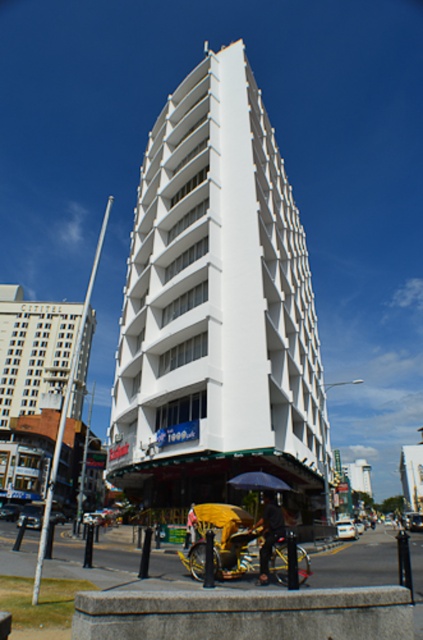
Can you confirm if dark gray fabric umbrella at center is positioned to the left of yellow fabric at center?

Incorrect, dark gray fabric umbrella at center is not on the left side of yellow fabric at center.

Is point (269, 513) less distant than point (186, 515)?

Yes, it is.

Where is `dark gray fabric umbrella at center`? This screenshot has height=640, width=423. dark gray fabric umbrella at center is located at coordinates (269, 532).

How much distance is there between white smooth building at center and yellow fabric rickshaw at lower center?

A distance of 20.34 meters exists between white smooth building at center and yellow fabric rickshaw at lower center.

Based on the photo, is white smooth building at center taller than yellow fabric rickshaw at lower center?

Yes.

I want to click on white smooth building at center, so click(217, 314).

Does white smooth building at center appear on the left side of yellow fabric at center?

Incorrect, white smooth building at center is not on the left side of yellow fabric at center.

Who is positioned more to the left, white smooth building at center or yellow fabric at center?

yellow fabric at center is more to the left.

Who is more forward, (170,124) or (189,540)?

Point (189,540) is more forward.

At what (x,y) coordinates should I click in order to perform the action: click on white smooth building at center. Please return your answer as a coordinate pair (x, y). Image resolution: width=423 pixels, height=640 pixels. Looking at the image, I should click on (217, 314).